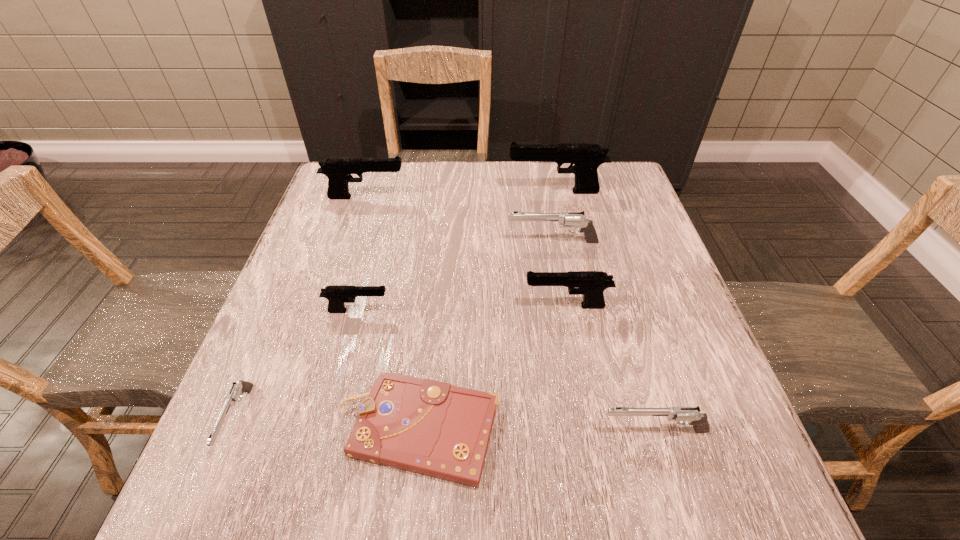
At what (x,y) coordinates should I click in order to perform the action: click on object positioned at the far right corner. Please return your answer as a coordinate pair (x, y). The image size is (960, 540). Looking at the image, I should click on (586, 158).

Image resolution: width=960 pixels, height=540 pixels. What are the coordinates of `vacant space at the far edge` in the screenshot? It's located at (556, 173).

Where is `blank area at the left edge`? The width and height of the screenshot is (960, 540). blank area at the left edge is located at coordinates (306, 399).

The image size is (960, 540). I want to click on vacant space at the right edge, so (652, 286).

In the image, there is a desktop. In order to click on vacant space at the far left corner in this screenshot , I will do `click(358, 190)`.

Where is `vacant space at the near right corner of the desktop`? This screenshot has height=540, width=960. vacant space at the near right corner of the desktop is located at coordinates (715, 495).

Identify the location of free spot between the tallest object and the smallest black pistol. (457, 251).

This screenshot has height=540, width=960. Find the location of `vacant area between the shortest object and the tallest object`. vacant area between the shortest object and the tallest object is located at coordinates (487, 310).

Identify the location of vacant region between the shortest pistol and the sixth nearest object. (395, 330).

Locate an element on the screen. The width and height of the screenshot is (960, 540). free point between the biggest silver pistol and the second biggest silver pistol is located at coordinates (604, 336).